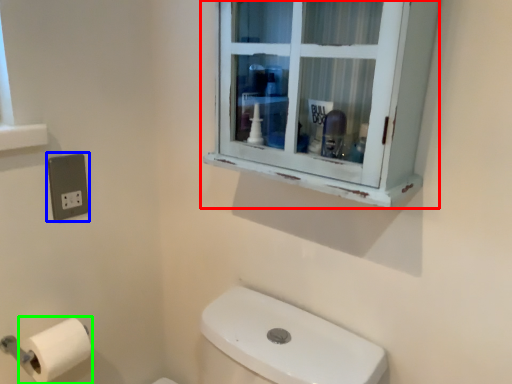
Question: Which object is positioned closest to window (highlighted by a red box)? Select from electric outlet (highlighted by a blue box) and toilet paper (highlighted by a green box).

Choices:
 (A) electric outlet
 (B) toilet paper

Answer: (A)